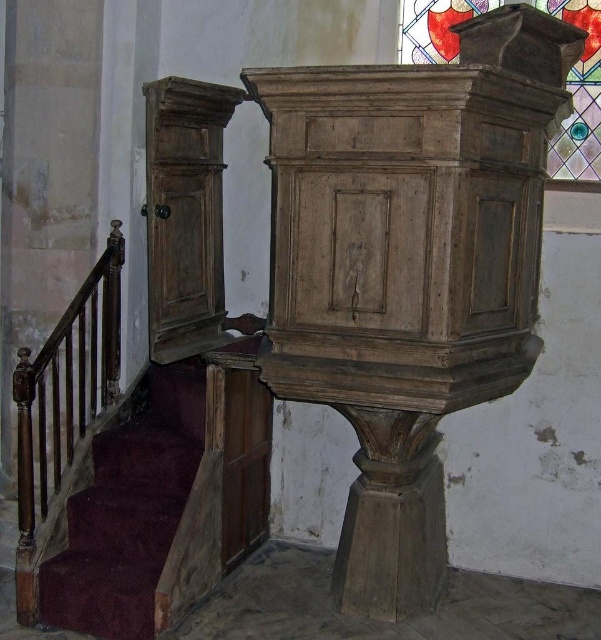
You are an interior designer planning to place a 2m wide decorative panel between the velvet burgundy stairs at lower left and the stained glass at upper right. Based on the scene, will the panel fit horizontally between them?

The velvet burgundy stairs at lower left is narrower than the stained glass at upper right, so the 2m wide decorative panel may not fit if the space between them is constrained by the stairs width. However, since the exact distance isn

You are standing in the church and want to approach the velvet burgundy stairs at lower left and the stained glass at upper right. Which object will you encounter first as you move forward?

You will encounter the velvet burgundy stairs at lower left first because it is closer to you than the stained glass at upper right.